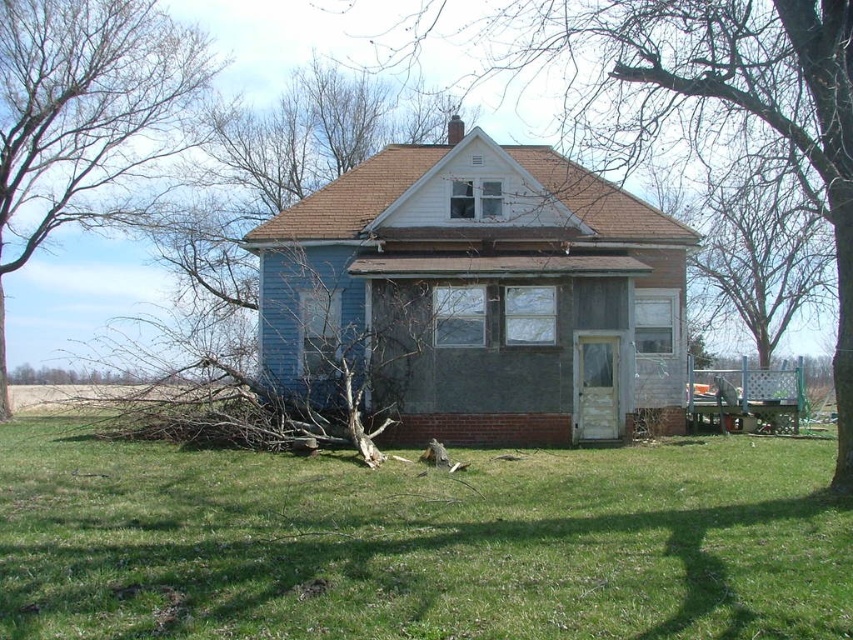
You are a landscape architect planning to install a new sprinkler system. The sprinkler has a maximum range of 50 feet. If you position the sprinkler at the gray bark tree at center, will it reach the bare branches at left?

The distance between the gray bark tree at center and the bare branches at left is 54.54 feet, which exceeds the sprinkler system maximum range of 50 feet. Therefore, the sprinkler will not reach the bare branches at left.

You are planning to plant a new tree in your backyard. You have a small sapling that needs a spot where there is enough space. Looking at the green grass at lower center and the gray bark tree at center, which area would be more suitable for planting the sapling?

The green grass at lower center has a smaller size compared to the gray bark tree at center, so the area with the gray bark tree at center likely has more space available for planting the sapling.